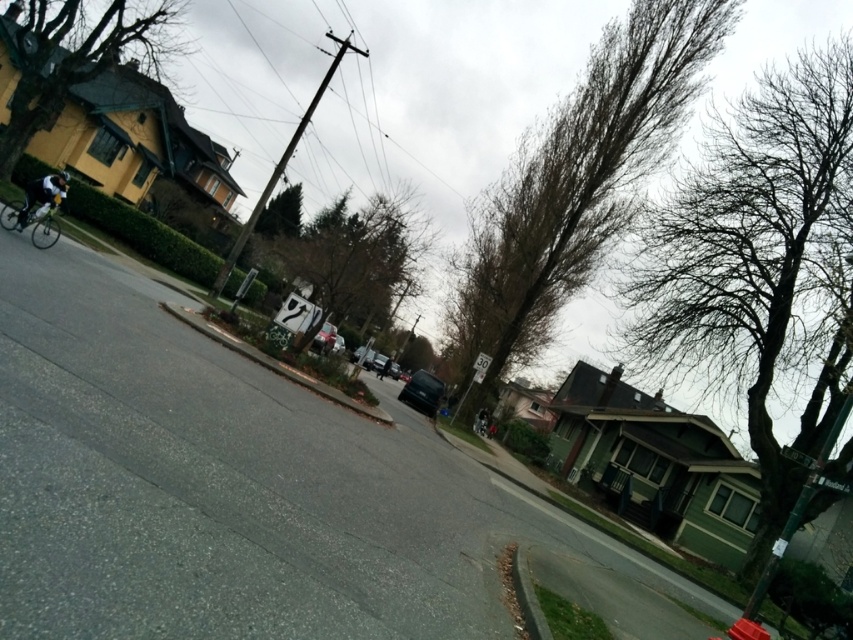
Question: Is green leafy tree at center positioned before white matte helmet at upper left?

Choices:
 (A) no
 (B) yes

Answer: (A)

Question: Among these objects, which one is farthest from the camera?

Choices:
 (A) green textured tree at upper left
 (B) bare branches at upper center
 (C) bare branches at upper right

Answer: (B)

Question: Does green leafy tree at center appear on the left side of shiny silver bicycle at left?

Choices:
 (A) no
 (B) yes

Answer: (A)

Question: Observing the image, what is the correct spatial positioning of green textured tree at upper left in reference to white matte helmet at upper left?

Choices:
 (A) above
 (B) below

Answer: (A)

Question: Estimate the real-world distances between objects in this image. Which object is closer to the shiny black bicycle at center?

Choices:
 (A) bare branches at upper right
 (B) shiny silver bicycle at left

Answer: (A)

Question: Which point appears closest to the camera in this image?

Choices:
 (A) (51, 234)
 (B) (608, 36)
 (C) (817, 241)

Answer: (A)